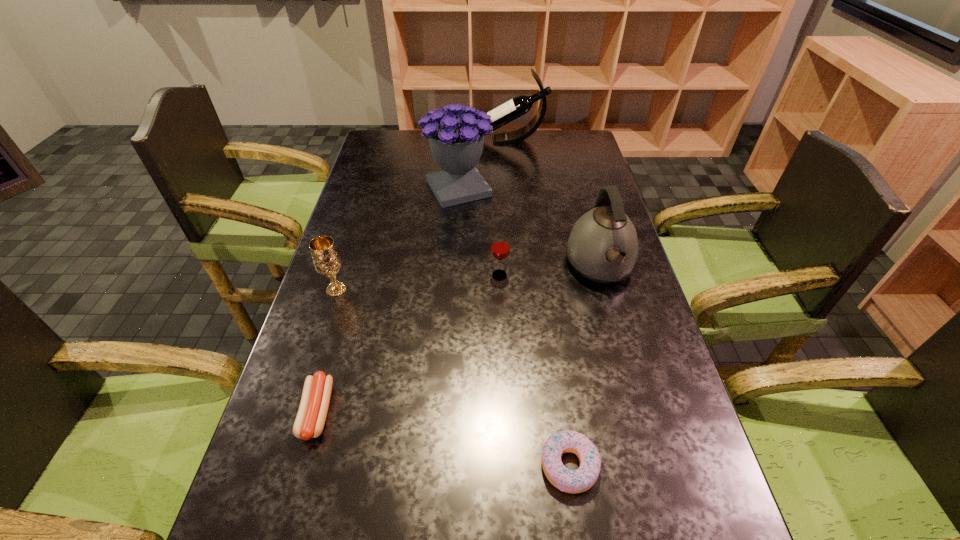
Locate an element on the screen. vacant area between the second farthest object and the wine bottle is located at coordinates (484, 164).

This screenshot has width=960, height=540. I want to click on empty space between the glass and the wine bottle, so click(x=505, y=207).

Locate an element on the screen. The image size is (960, 540). vacant area that lies between the doughnut and the fourth shortest object is located at coordinates (453, 377).

This screenshot has width=960, height=540. I want to click on object that is the fifth closest to the doughnut, so click(x=456, y=142).

This screenshot has width=960, height=540. What are the coordinates of `the fifth closest object to the kettle` in the screenshot? It's located at (326, 259).

This screenshot has width=960, height=540. I want to click on vacant position in the image that satisfies the following two spatial constraints: 1. on the back side of the fifth tallest object; 2. on the left side of the chalice, so click(341, 275).